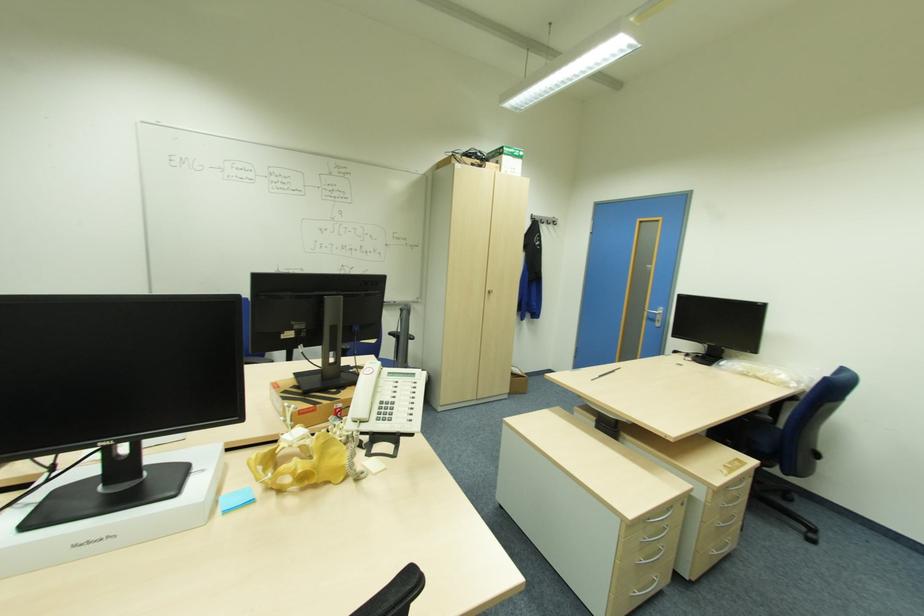
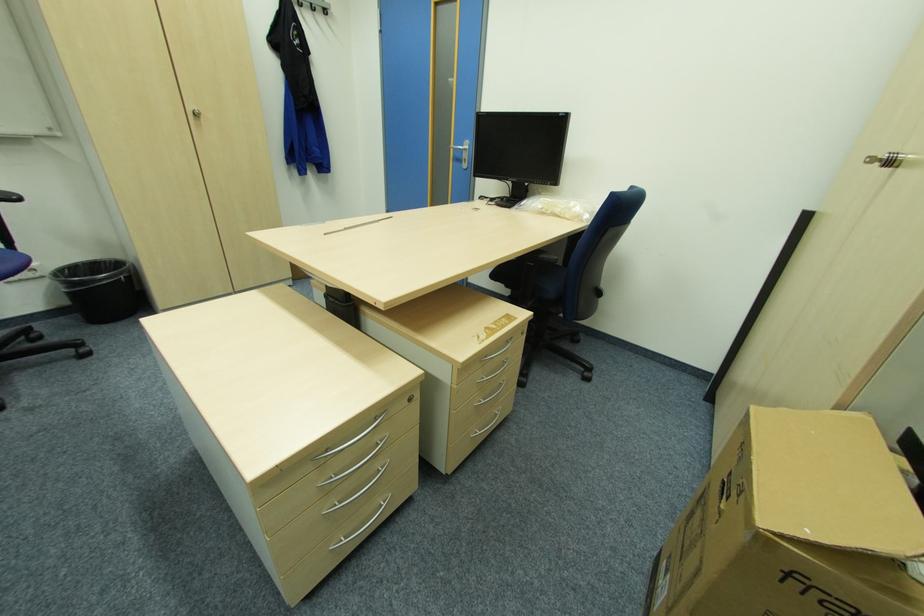
In the second image, find the point that corresponds to pixel 662 313 in the first image.

(468, 148)